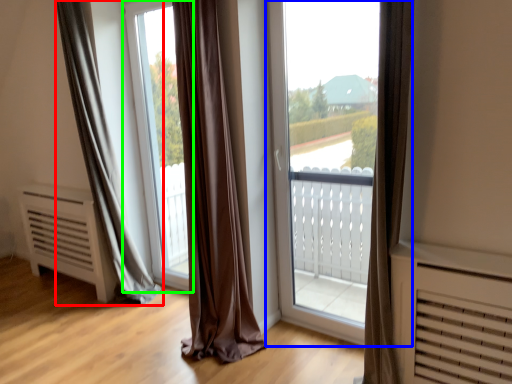
Question: Based on their relative distances, which object is farther from curtain (highlighted by a red box)? Choose from window (highlighted by a blue box) and window screen (highlighted by a green box).

Choices:
 (A) window
 (B) window screen

Answer: (A)